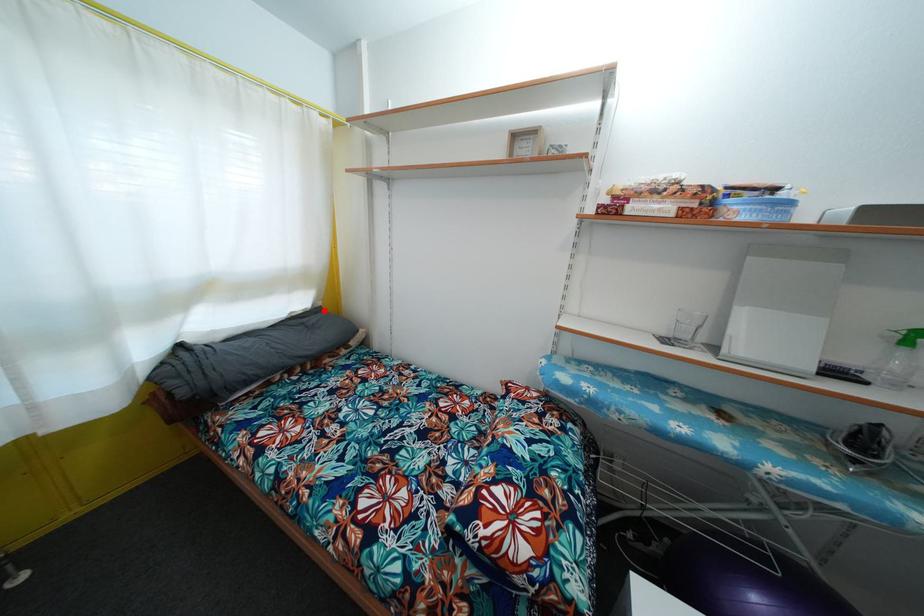
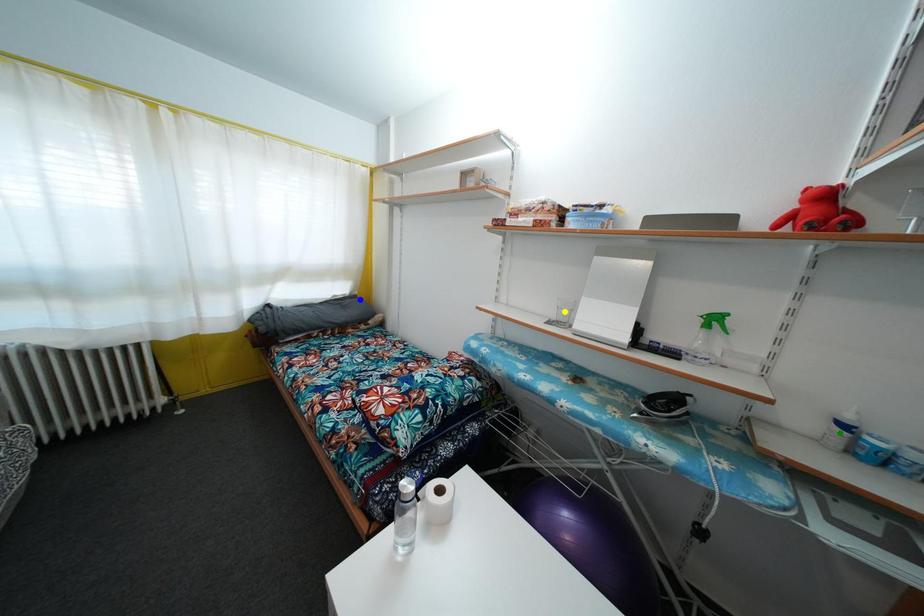
Question: I am providing you with two images of the same scene from different viewpoints. A red point is marked on the first image. You are given multiple points on the second image. Which point in image 2 represents the same 3d spot as the red point in image 1?

Choices:
 (A) blue point
 (B) yellow point
 (C) green point

Answer: (A)